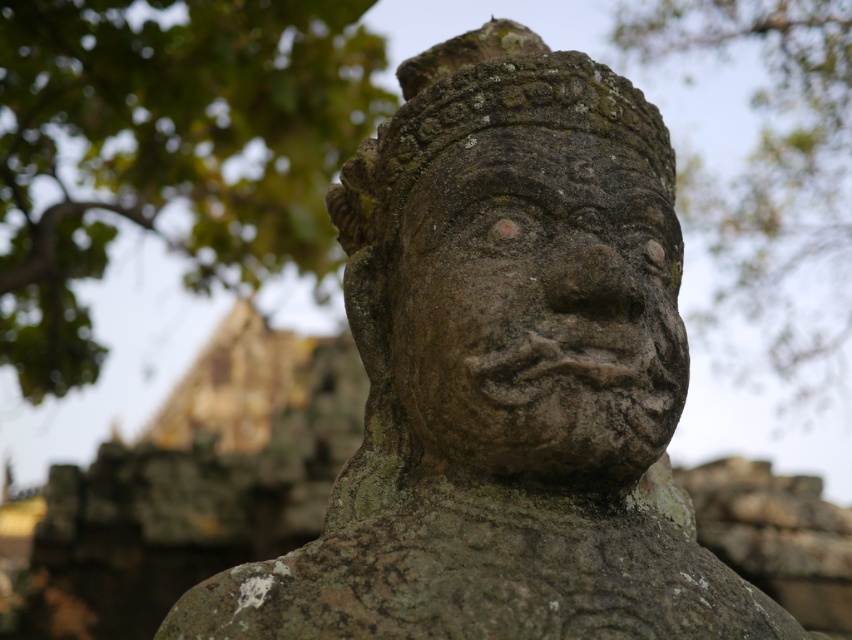
From the picture: You are standing in front of a statue and want to take a photo of the green mossy stone statue at upper center. The statue is located at point (167, 148). Where should you position yourself to capture the statue in the center of your photo?

To capture the green mossy stone statue at upper center in the center of your photo, position yourself directly in front of the statue at point (167, 148).

You are an art conservator assessing the statue. You notice two areas of the statue that have different textures and growths. Which part of the statue has a shorter height between the rough stone face at center and the green mossy stone face at upper center?

Result: The rough stone face at center is shorter than the green mossy stone face at upper center.

Looking at this image, you are an art conservator examining the green mossy stone statue at upper center and the rough stone face at center. Which object is closer to you based on their positions in the image?

The rough stone face at center is behind the green mossy stone statue at upper center, so the green mossy stone statue at upper center is closer to you.